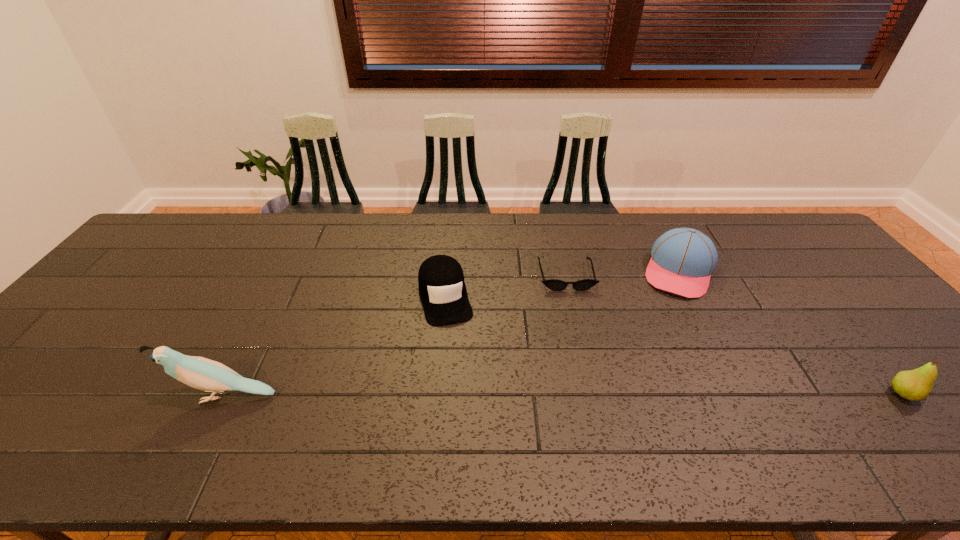
This screenshot has width=960, height=540. I want to click on bird, so click(x=201, y=373).

Identify the location of the tallest object. This screenshot has height=540, width=960. (201, 373).

Find the location of a particular element. This screenshot has height=540, width=960. the rightmost object is located at coordinates (916, 385).

What are the coordinates of `the third object from left to right` in the screenshot? It's located at (553, 284).

The width and height of the screenshot is (960, 540). In order to click on sunglasses in this screenshot , I will do `click(553, 284)`.

Locate an element on the screen. The width and height of the screenshot is (960, 540). the fourth object from left to right is located at coordinates (682, 261).

Locate an element on the screen. cap is located at coordinates pyautogui.click(x=442, y=289).

This screenshot has width=960, height=540. I want to click on the fourth tallest object, so click(x=442, y=289).

The height and width of the screenshot is (540, 960). I want to click on free space located at the face of the leftmost object, so click(64, 396).

This screenshot has width=960, height=540. Find the location of `vacant region located at the face of the leftmost object`. vacant region located at the face of the leftmost object is located at coordinates (112, 396).